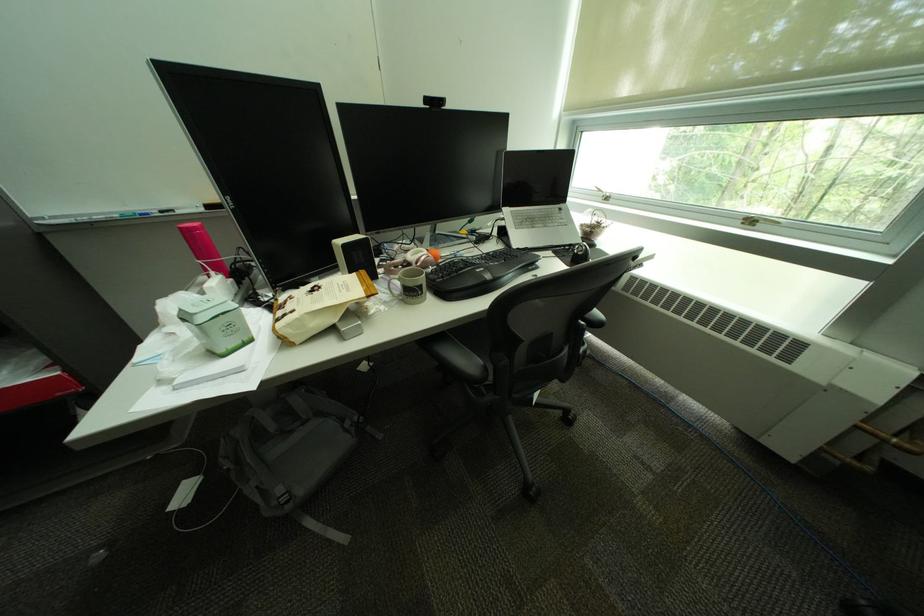
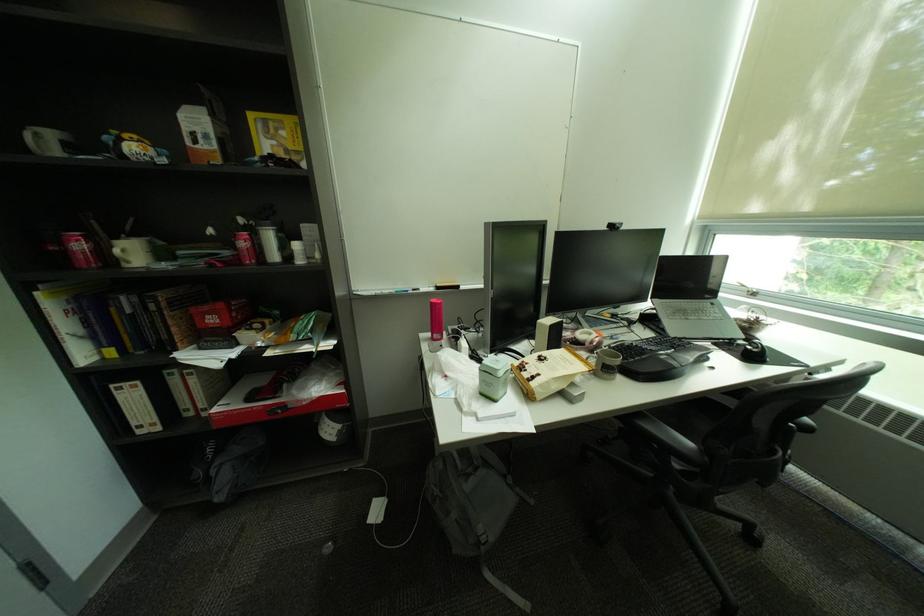
Find the pixel in the second image that matches (x=238, y=459) in the first image.

(446, 487)